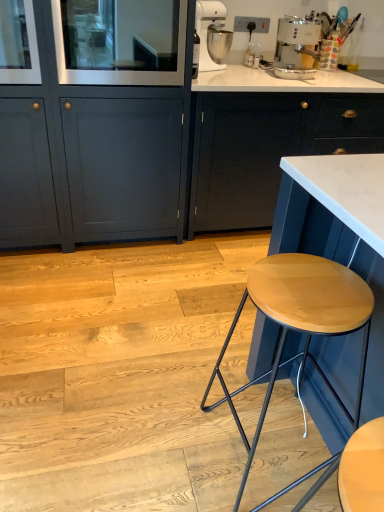
Describe the element at coordinates (296, 47) in the screenshot. I see `white glossy coffee machine at upper right` at that location.

Describe the element at coordinates (120, 42) in the screenshot. The width and height of the screenshot is (384, 512). I see `clear glass door at upper left` at that location.

In order to face matte gray cabinet at lower left, positioned as the 1th cabinetry in left-to-right order, should I rotate leftwards or rightwards?

To align with it, rotate left about 14.515°.

The width and height of the screenshot is (384, 512). Find the location of `wooden stool at right`. wooden stool at right is located at coordinates (300, 321).

Consider the image. Is white glossy coffee machine at upper right taller than wooden stool at right?

No, white glossy coffee machine at upper right is not taller than wooden stool at right.

How different are the orientations of white glossy coffee machine at upper right and wooden stool at right in degrees?

The angular difference between white glossy coffee machine at upper right and wooden stool at right is 82 degrees.

From the picture: Is white glossy coffee machine at upper right next to wooden stool at right?

white glossy coffee machine at upper right and wooden stool at right are not in contact.

At what (x,y) coordinates should I click in order to perform the action: click on home appliance above the wooden stool at right (from a real-world perspective). Please return your answer as a coordinate pair (x, y). This screenshot has width=384, height=512. Looking at the image, I should click on (296, 47).

Which object is positioned more to the left, matte gray cabinet at lower left, positioned as the 1th cabinetry in left-to-right order, or clear glass door at upper left?

matte gray cabinet at lower left, positioned as the 1th cabinetry in left-to-right order.

From the image's perspective, which one is positioned higher, matte gray cabinet at lower left, positioned as the 1th cabinetry in left-to-right order, or clear glass door at upper left?

From the image's view, clear glass door at upper left is above.

Considering the points (216, 108) and (75, 50), which point is behind, point (216, 108) or point (75, 50)?

Point (216, 108)

Measure the distance between clear glass door at upper left and wooden stool at right.

clear glass door at upper left is 1.36 meters from wooden stool at right.

Locate an element on the screen. The height and width of the screenshot is (512, 384). stool in front of the clear glass door at upper left is located at coordinates click(x=300, y=321).

Is clear glass door at upper left located outside wooden stool at right?

That's correct, clear glass door at upper left is outside of wooden stool at right.

In the scene shown: Relative to matte dark blue cabinet at center, the 1th cabinetry when ordered from right to left, is wooden stool at right in front or behind?

Clearly, wooden stool at right is in front of matte dark blue cabinet at center, the 1th cabinetry when ordered from right to left.

Which is in front, point (253, 284) or point (252, 191)?

The point (253, 284) is closer.

From the picture: Considering the positions of objects wooden stool at right and matte dark blue cabinet at center, marked as the second cabinetry in a left-to-right arrangement, in the image provided, who is more to the right, wooden stool at right or matte dark blue cabinet at center, marked as the second cabinetry in a left-to-right arrangement,?

matte dark blue cabinet at center, marked as the second cabinetry in a left-to-right arrangement.

From a real-world perspective, which object stands above the other?

clear glass door at upper left.

In terms of height, does clear glass door at upper left look taller or shorter compared to white glossy coffee machine at upper right?

In the image, clear glass door at upper left appears to be taller than white glossy coffee machine at upper right.

Would you consider clear glass door at upper left to be distant from white glossy coffee machine at upper right?

They are positioned close to each other.

Considering the relative sizes of clear glass door at upper left and white glossy coffee machine at upper right in the image provided, is clear glass door at upper left wider than white glossy coffee machine at upper right?

Yes, clear glass door at upper left is wider than white glossy coffee machine at upper right.

Considering the positions of objects matte dark blue cabinet at center, the 1th cabinetry when ordered from right to left, and wooden stool at right in the image provided, who is more to the right, matte dark blue cabinet at center, the 1th cabinetry when ordered from right to left, or wooden stool at right?

matte dark blue cabinet at center, the 1th cabinetry when ordered from right to left, is more to the right.

Which point is more distant from viewer, (280, 146) or (263, 298)?

The point (280, 146) is farther.

Do you think matte dark blue cabinet at center, marked as the second cabinetry in a left-to-right arrangement, is within wooden stool at right, or outside of it?

matte dark blue cabinet at center, marked as the second cabinetry in a left-to-right arrangement, is not inside wooden stool at right, it's outside.

From their relative heights in the image, would you say matte dark blue cabinet at center, the 1th cabinetry when ordered from right to left, is taller or shorter than wooden stool at right?

matte dark blue cabinet at center, the 1th cabinetry when ordered from right to left, is taller than wooden stool at right.

Image resolution: width=384 pixels, height=512 pixels. What are the coordinates of `the 2nd cabinetry below the white glossy coffee machine at upper right (from a real-world perspective)` in the screenshot? It's located at (267, 148).

Measure the distance from white glossy coffee machine at upper right to matte dark blue cabinet at center, marked as the second cabinetry in a left-to-right arrangement.

A distance of 19.91 inches exists between white glossy coffee machine at upper right and matte dark blue cabinet at center, marked as the second cabinetry in a left-to-right arrangement.

Does point (279, 71) come in front of point (252, 167)?

That is False.

Which object is wider, white glossy coffee machine at upper right or matte dark blue cabinet at center, marked as the second cabinetry in a left-to-right arrangement?

matte dark blue cabinet at center, marked as the second cabinetry in a left-to-right arrangement, is wider.

The width and height of the screenshot is (384, 512). In order to click on home appliance above the wooden stool at right (from the image's perspective) in this screenshot , I will do `click(296, 47)`.

The height and width of the screenshot is (512, 384). Find the location of `glass door located above the matte gray cabinet at lower left, positioned as the 1th cabinetry in left-to-right order (from a real-world perspective)`. glass door located above the matte gray cabinet at lower left, positioned as the 1th cabinetry in left-to-right order (from a real-world perspective) is located at coordinates (120, 42).

Looking at the image, which one is located closer to clear glass door at upper left, white glossy coffee machine at upper right or matte gray cabinet at lower left, placed as the second cabinetry when sorted from right to left?

matte gray cabinet at lower left, placed as the second cabinetry when sorted from right to left, is positioned closer to the anchor clear glass door at upper left.

When comparing their distances from white metallic stand mixer at upper center, does wooden stool at right or clear glass door at upper left seem further?

wooden stool at right lies further to white metallic stand mixer at upper center than the other object.

Based on their spatial positions, is white metallic stand mixer at upper center or clear glass door at upper left further from wooden stool at right?

Based on the image, white metallic stand mixer at upper center appears to be further to wooden stool at right.

From the image, which object appears to be nearer to wooden stool at right, matte gray cabinet at lower left, positioned as the 1th cabinetry in left-to-right order, or white metallic stand mixer at upper center?

matte gray cabinet at lower left, positioned as the 1th cabinetry in left-to-right order, is positioned closer to the anchor wooden stool at right.

Based on their spatial positions, is clear glass door at upper left or wooden stool at right closer to white metallic stand mixer at upper center?

Based on the image, clear glass door at upper left appears to be nearer to white metallic stand mixer at upper center.

Looking at the image, which one is located further to white metallic stand mixer at upper center, matte dark blue cabinet at center, the 1th cabinetry when ordered from right to left, or clear glass door at upper left?

matte dark blue cabinet at center, the 1th cabinetry when ordered from right to left, is positioned further to the anchor white metallic stand mixer at upper center.

Estimate the real-world distances between objects in this image. Which object is further from white glossy coffee machine at upper right, matte gray cabinet at lower left, positioned as the 1th cabinetry in left-to-right order, or clear glass door at upper left?

clear glass door at upper left is further to white glossy coffee machine at upper right.

Estimate the real-world distances between objects in this image. Which object is closer to white glossy coffee machine at upper right, wooden stool at right or white metallic stand mixer at upper center?

The object closer to white glossy coffee machine at upper right is white metallic stand mixer at upper center.

In order to click on home appliance between white metallic stand mixer at upper center and wooden stool at right from top to bottom in this screenshot , I will do `click(296, 47)`.

Find the location of a particular element. glass door situated between matte gray cabinet at lower left, placed as the second cabinetry when sorted from right to left, and white metallic stand mixer at upper center from left to right is located at coordinates (120, 42).

Identify the location of kitchen appliance between clear glass door at upper left and matte dark blue cabinet at center, the 1th cabinetry when ordered from right to left, in the horizontal direction. Image resolution: width=384 pixels, height=512 pixels. (207, 31).

You are a GUI agent. You are given a task and a screenshot of the screen. Output one action in this format:
    pyautogui.click(x=<x>, y=<y>)
    Task: Click on the home appliance between matte gray cabinet at lower left, positioned as the 1th cabinetry in left-to-right order, and matte dark blue cabinet at center, marked as the second cabinetry in a left-to-right arrangement, from left to right
    The height and width of the screenshot is (512, 384).
    Given the screenshot: What is the action you would take?
    pyautogui.click(x=296, y=47)